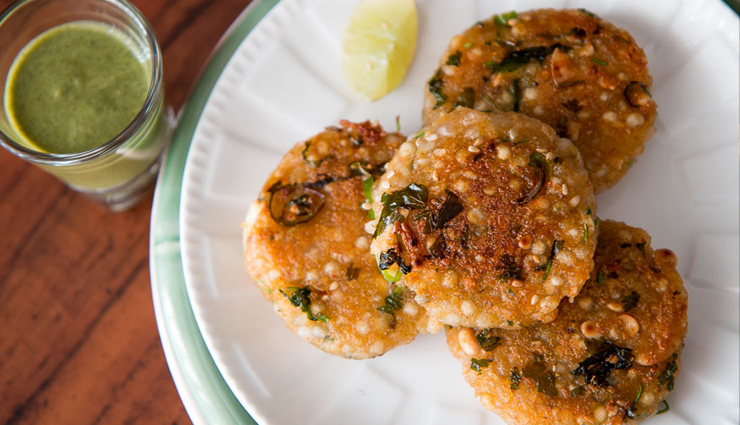
Identify the location of plate. The width and height of the screenshot is (740, 425). (413, 380), (342, 382), (297, 70), (676, 208).